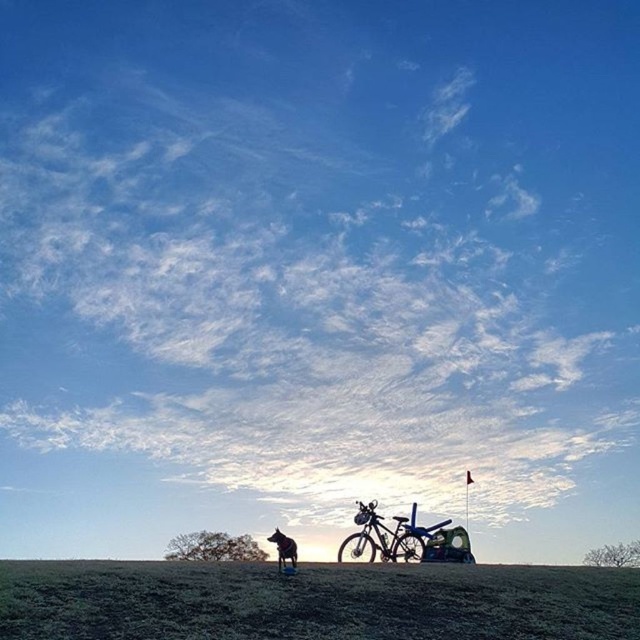
Does green grassy field at lower center appear on the left side of shiny metallic bicycle at center?

Correct, you'll find green grassy field at lower center to the left of shiny metallic bicycle at center.

Between green grassy field at lower center and shiny metallic bicycle at center, which one is positioned higher?

green grassy field at lower center is above.

Between point (588, 600) and point (408, 538), which one is positioned behind?

The point (408, 538) is more distant.

The image size is (640, 640). Find the location of `green grassy field at lower center`. green grassy field at lower center is located at coordinates (314, 602).

Between shiny metallic bicycle at center and shiny black dog at lower center, which one has less height?

Standing shorter between the two is shiny black dog at lower center.

How distant is shiny metallic bicycle at center from shiny black dog at lower center?

shiny metallic bicycle at center is 3.10 meters away from shiny black dog at lower center.

What do you see at coordinates (385, 536) in the screenshot? The width and height of the screenshot is (640, 640). I see `shiny metallic bicycle at center` at bounding box center [385, 536].

Find the location of `shiny metallic bicycle at center`. shiny metallic bicycle at center is located at coordinates (385, 536).

Which of these two, green grassy field at lower center or shiny black dog at lower center, stands taller?

green grassy field at lower center is taller.

Is green grassy field at lower center to the left of shiny black dog at lower center from the viewer's perspective?

In fact, green grassy field at lower center is to the right of shiny black dog at lower center.

The image size is (640, 640). What do you see at coordinates (314, 602) in the screenshot? I see `green grassy field at lower center` at bounding box center [314, 602].

You are a GUI agent. You are given a task and a screenshot of the screen. Output one action in this format:
    pyautogui.click(x=<x>, y=<y>)
    Task: Click on the green grassy field at lower center
    Image resolution: width=640 pixels, height=640 pixels.
    Given the screenshot: What is the action you would take?
    pyautogui.click(x=314, y=602)